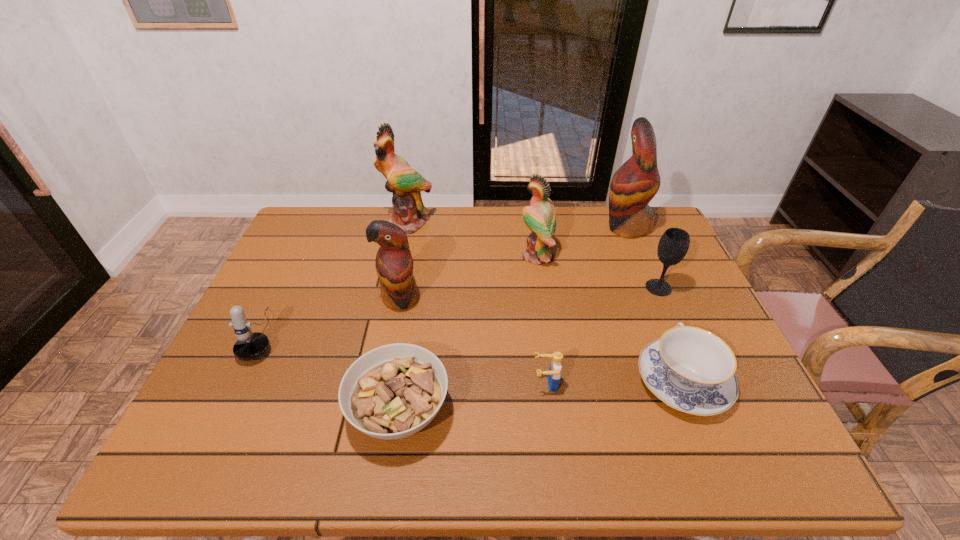
You are a GUI agent. You are given a task and a screenshot of the screen. Output one action in this format:
    pyautogui.click(x=<x>, y=<y>)
    Task: Click on the free space at the far left corner
    
    Given the screenshot: What is the action you would take?
    pyautogui.click(x=304, y=218)

Find the location of a particular element. free point between the left green parrot and the right red parrot is located at coordinates (517, 225).

I want to click on free area in between the Lego and the gray stew, so click(x=472, y=397).

Find the location of a particular element. blank region between the wineglass and the bigger red parrot is located at coordinates (642, 257).

Image resolution: width=960 pixels, height=540 pixels. In order to click on vacant region between the microphone and the chinaware in this screenshot , I will do `click(473, 357)`.

Where is `free spot between the wineglass and the Lego`? free spot between the wineglass and the Lego is located at coordinates (602, 336).

In order to click on free area in between the nearer green parrot and the left green parrot in this screenshot , I will do `click(472, 240)`.

This screenshot has width=960, height=540. Identify the location of vacant space that's between the Lego and the blue chinaware. [x=614, y=382].

Select which object appears as the fourth closest to the farther red parrot. Please provide its 2D coordinates. Your answer should be formatted as a tuple, i.e. [(x, y)], where the tuple contains the x and y coordinates of a point satisfying the conditions above.

[(405, 183)]

Identify which object is located as the seventh nearest to the fourth shortest object. Please provide its 2D coordinates. Your answer should be formatted as a tuple, i.e. [(x, y)], where the tuple contains the x and y coordinates of a point satisfying the conditions above.

[(636, 182)]